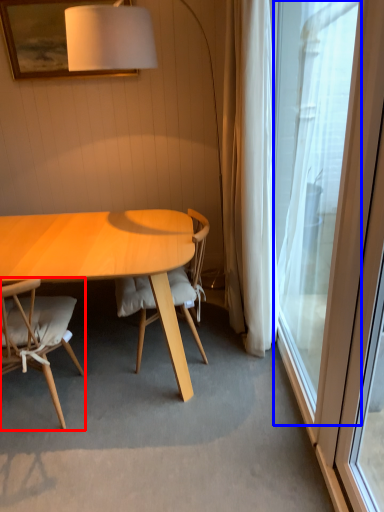
Question: Which object appears closest to the camera in this image, chair (highlighted by a red box) or window (highlighted by a blue box)?

Choices:
 (A) chair
 (B) window

Answer: (B)